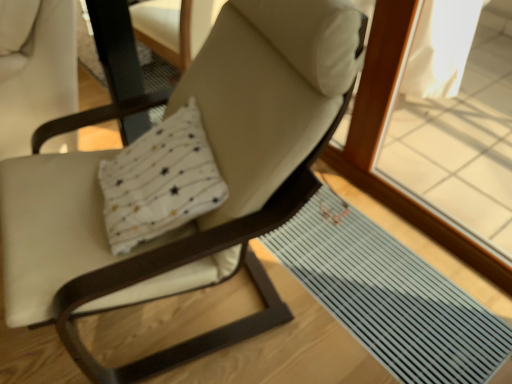
Question: Is gray rubber mat at lower right aimed at matte white chair at center?

Choices:
 (A) no
 (B) yes

Answer: (A)

Question: From the image's perspective, is gray rubber mat at lower right over matte white chair at center?

Choices:
 (A) yes
 (B) no

Answer: (B)

Question: Does gray rubber mat at lower right lie behind matte white chair at center?

Choices:
 (A) no
 (B) yes

Answer: (B)

Question: Considering the relative positions of gray rubber mat at lower right and matte white chair at center in the image provided, is gray rubber mat at lower right to the right of matte white chair at center from the viewer's perspective?

Choices:
 (A) yes
 (B) no

Answer: (A)

Question: Considering the relative sizes of gray rubber mat at lower right and matte white chair at center in the image provided, is gray rubber mat at lower right shorter than matte white chair at center?

Choices:
 (A) no
 (B) yes

Answer: (B)

Question: From a real-world perspective, is matte white swivel chair at left positioned above or below white soft pillow at center?

Choices:
 (A) above
 (B) below

Answer: (B)

Question: In the image, is matte white swivel chair at left positioned in front of or behind white soft pillow at center?

Choices:
 (A) behind
 (B) front

Answer: (A)

Question: Is matte white swivel chair at left bigger or smaller than white soft pillow at center?

Choices:
 (A) big
 (B) small

Answer: (A)

Question: In terms of width, does matte white swivel chair at left look wider or thinner when compared to white soft pillow at center?

Choices:
 (A) wide
 (B) thin

Answer: (B)

Question: Based on their sizes in the image, would you say gray rubber mat at lower right is bigger or smaller than white soft pillow at center?

Choices:
 (A) small
 (B) big

Answer: (A)

Question: Is point (468, 327) positioned closer to the camera than point (164, 173)?

Choices:
 (A) closer
 (B) farther

Answer: (B)

Question: From the image's perspective, relative to white soft pillow at center, is gray rubber mat at lower right above or below?

Choices:
 (A) below
 (B) above

Answer: (A)

Question: In the image, is gray rubber mat at lower right on the left side or the right side of white soft pillow at center?

Choices:
 (A) right
 (B) left

Answer: (A)

Question: Based on their sizes in the image, would you say matte white chair at center is bigger or smaller than white soft pillow at center?

Choices:
 (A) big
 (B) small

Answer: (A)

Question: Is matte white chair at center situated inside white soft pillow at center or outside?

Choices:
 (A) outside
 (B) inside

Answer: (A)